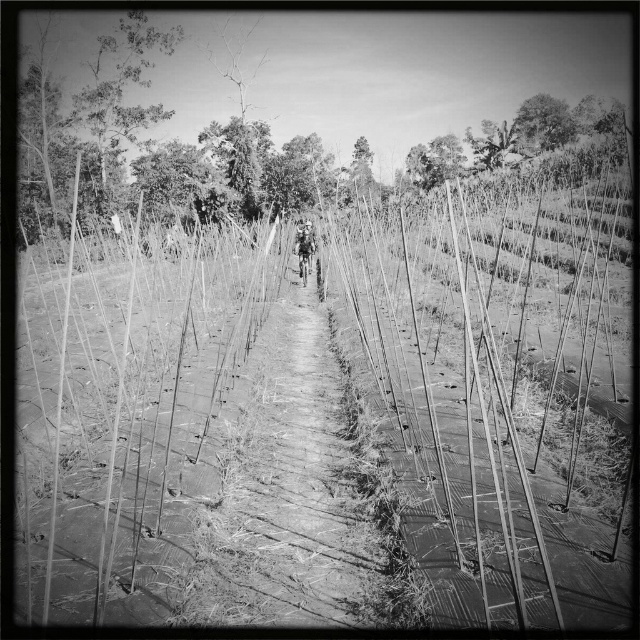
Question: Estimate the real-world distances between objects in this image. Which object is closer to the thick foliage at center?

Choices:
 (A) smooth bark tree at upper center
 (B) smooth bamboo at center

Answer: (B)

Question: Which object is closer to the camera taking this photo?

Choices:
 (A) smooth bark tree at upper center
 (B) thick foliage at center

Answer: (B)

Question: Does smooth bamboo at center appear under smooth bark tree at upper center?

Choices:
 (A) no
 (B) yes

Answer: (B)

Question: Considering the relative positions of smooth bamboo at center and thick foliage at center in the image provided, where is smooth bamboo at center located with respect to thick foliage at center?

Choices:
 (A) below
 (B) above

Answer: (A)

Question: Which of the following is the closest to the observer?

Choices:
 (A) smooth bamboo at center
 (B) smooth bark tree at upper center

Answer: (A)

Question: Is thick foliage at center below smooth bark tree at upper center?

Choices:
 (A) no
 (B) yes

Answer: (B)